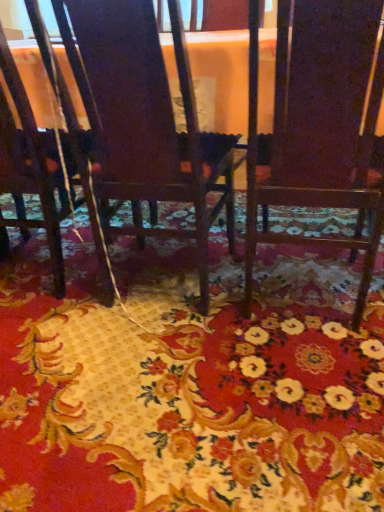
Question: Is wooden chair at center, which is counted as the 3th chair, starting from the left, oriented away from floral carpet at center?

Choices:
 (A) no
 (B) yes

Answer: (A)

Question: Considering the relative positions of wooden chair at center, which is counted as the 3th chair, starting from the left, and floral carpet at center in the image provided, is wooden chair at center, which is counted as the 3th chair, starting from the left, to the left of floral carpet at center from the viewer's perspective?

Choices:
 (A) yes
 (B) no

Answer: (B)

Question: From the image's perspective, is wooden chair at center, which is counted as the 3th chair, starting from the left, below floral carpet at center?

Choices:
 (A) no
 (B) yes

Answer: (A)

Question: Considering the relative sizes of wooden chair at center, positioned as the first chair in right-to-left order, and floral carpet at center in the image provided, is wooden chair at center, positioned as the first chair in right-to-left order, smaller than floral carpet at center?

Choices:
 (A) no
 (B) yes

Answer: (A)

Question: Is wooden chair at center, which is counted as the 3th chair, starting from the left, closer to camera compared to floral carpet at center?

Choices:
 (A) no
 (B) yes

Answer: (A)

Question: Considering the relative sizes of wooden chair at center, which is counted as the 3th chair, starting from the left, and floral carpet at center in the image provided, is wooden chair at center, which is counted as the 3th chair, starting from the left, taller than floral carpet at center?

Choices:
 (A) yes
 (B) no

Answer: (A)

Question: Can you confirm if floral carpet at center is shorter than wooden chair at center, positioned as the first chair in right-to-left order?

Choices:
 (A) yes
 (B) no

Answer: (A)

Question: Could you tell me if floral carpet at center is turned towards wooden chair at center, positioned as the first chair in right-to-left order?

Choices:
 (A) no
 (B) yes

Answer: (A)

Question: Is floral carpet at center further to camera compared to wooden chair at center, which is counted as the 3th chair, starting from the left?

Choices:
 (A) no
 (B) yes

Answer: (A)

Question: Is floral carpet at center thinner than wooden chair at center, positioned as the first chair in right-to-left order?

Choices:
 (A) yes
 (B) no

Answer: (B)

Question: Can you confirm if floral carpet at center is positioned to the left of wooden chair at center, positioned as the first chair in right-to-left order?

Choices:
 (A) no
 (B) yes

Answer: (B)

Question: Is floral carpet at center oriented away from wooden chair at center, which is counted as the 3th chair, starting from the left?

Choices:
 (A) no
 (B) yes

Answer: (A)

Question: From a real-world perspective, is wooden chair at center, positioned as the first chair in right-to-left order, located higher than dark wood chair at center, acting as the second chair starting from the right?

Choices:
 (A) yes
 (B) no

Answer: (B)